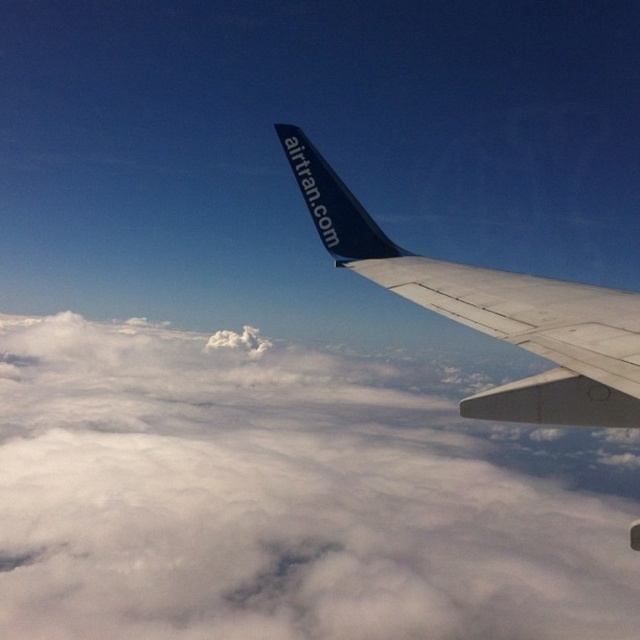
Who is lower down, white fluffy cloud at upper center or matte blue wing at upper right?

white fluffy cloud at upper center

Which is above, white fluffy cloud at upper center or matte blue wing at upper right?

Positioned higher is matte blue wing at upper right.

The height and width of the screenshot is (640, 640). I want to click on white fluffy cloud at upper center, so click(292, 496).